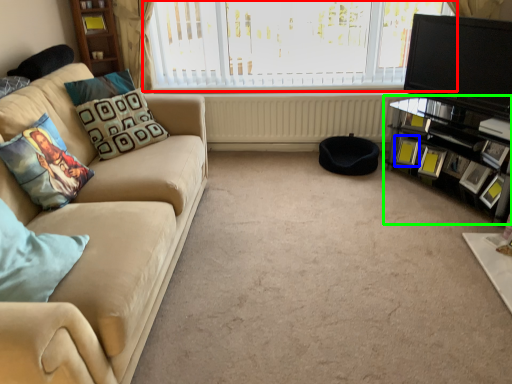
Question: Based on their relative distances, which object is farther from window (highlighted by a red box)? Choose from picture frame (highlighted by a blue box) and entertainment center (highlighted by a green box).

Choices:
 (A) picture frame
 (B) entertainment center

Answer: (A)